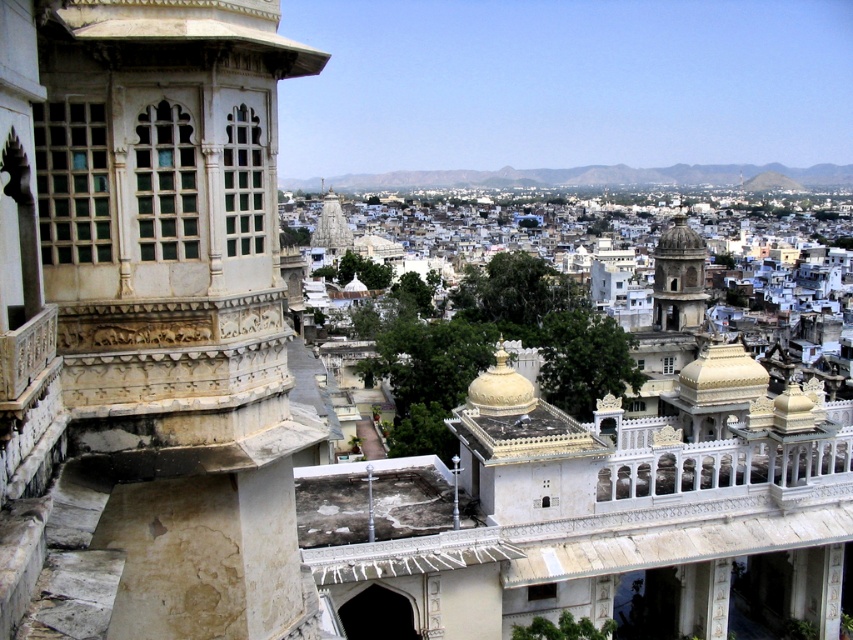
Question: Is smooth stone tower at center-right above white marble temple at center?

Choices:
 (A) yes
 (B) no

Answer: (B)

Question: Which object is positioned closest to the white marble temple at center?

Choices:
 (A) smooth stone tower at center-right
 (B) white marble palace at center

Answer: (A)

Question: Does white marble palace at center appear on the left side of white marble temple at center?

Choices:
 (A) yes
 (B) no

Answer: (B)

Question: Is white marble palace at center positioned before white marble temple at center?

Choices:
 (A) no
 (B) yes

Answer: (B)

Question: Which object is closer to the camera taking this photo?

Choices:
 (A) white marble palace at center
 (B) white marble temple at center
 (C) smooth stone tower at center-right

Answer: (A)

Question: Among these objects, which one is nearest to the camera?

Choices:
 (A) smooth stone tower at center-right
 (B) white marble palace at center
 (C) white marble temple at center

Answer: (B)